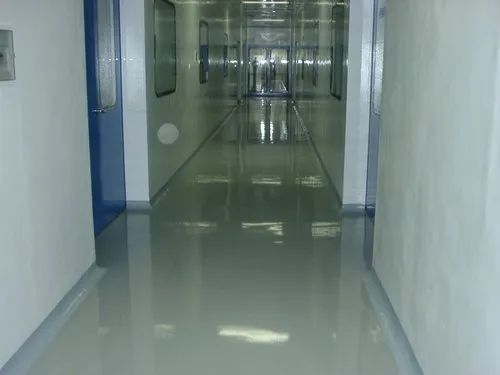
Image resolution: width=500 pixels, height=375 pixels. What are the coordinates of `doorways` in the screenshot? It's located at (97, 91), (375, 108).